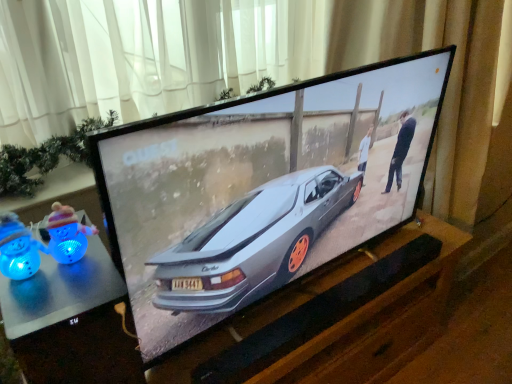
Question: From a real-world perspective, is white sheer curtain at upper center physically below blue plastic toy at lower left, which is counted as the second toy, starting from the right?

Choices:
 (A) no
 (B) yes

Answer: (A)

Question: Is white sheer curtain at upper center at the left side of blue plastic toy at lower left, marked as the 1th toy in a left-to-right arrangement?

Choices:
 (A) yes
 (B) no

Answer: (B)

Question: Is white sheer curtain at upper center smaller than blue plastic toy at lower left, marked as the 1th toy in a left-to-right arrangement?

Choices:
 (A) yes
 (B) no

Answer: (B)

Question: Is white sheer curtain at upper center thinner than blue plastic toy at lower left, which is counted as the second toy, starting from the right?

Choices:
 (A) yes
 (B) no

Answer: (B)

Question: Can you confirm if white sheer curtain at upper center is bigger than blue plastic toy at lower left, which is counted as the second toy, starting from the right?

Choices:
 (A) yes
 (B) no

Answer: (A)

Question: Is point (20, 273) closer or farther from the camera than point (197, 52)?

Choices:
 (A) farther
 (B) closer

Answer: (B)

Question: From a real-world perspective, relative to white sheer curtain at upper center, is blue plastic toy at lower left, marked as the 1th toy in a left-to-right arrangement, vertically above or below?

Choices:
 (A) above
 (B) below

Answer: (B)

Question: Is blue plastic toy at lower left, marked as the 1th toy in a left-to-right arrangement, in front of or behind white sheer curtain at upper center in the image?

Choices:
 (A) front
 (B) behind

Answer: (A)

Question: Looking at their shapes, would you say blue plastic toy at lower left, which is counted as the second toy, starting from the right, is wider or thinner than white sheer curtain at upper center?

Choices:
 (A) thin
 (B) wide

Answer: (A)

Question: Considering the positions of white sheer curtain at upper center and metallic silver table at lower left in the image, is white sheer curtain at upper center bigger or smaller than metallic silver table at lower left?

Choices:
 (A) small
 (B) big

Answer: (B)

Question: From the image's perspective, relative to metallic silver table at lower left, is white sheer curtain at upper center above or below?

Choices:
 (A) below
 (B) above

Answer: (B)

Question: Does point (488, 51) appear closer or farther from the camera than point (96, 317)?

Choices:
 (A) closer
 (B) farther

Answer: (B)

Question: Would you say white sheer curtain at upper center is to the left or to the right of metallic silver table at lower left in the picture?

Choices:
 (A) left
 (B) right

Answer: (B)

Question: Considering the positions of blue plastic toy at left, positioned as the 2th toy in left-to-right order, and white sheer curtain at upper center in the image, is blue plastic toy at left, positioned as the 2th toy in left-to-right order, wider or thinner than white sheer curtain at upper center?

Choices:
 (A) wide
 (B) thin

Answer: (B)

Question: Considering the positions of blue plastic toy at left, positioned as the 2th toy in left-to-right order, and white sheer curtain at upper center in the image, is blue plastic toy at left, positioned as the 2th toy in left-to-right order, taller or shorter than white sheer curtain at upper center?

Choices:
 (A) short
 (B) tall

Answer: (A)